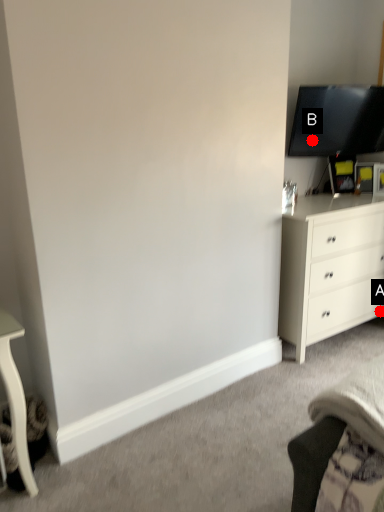
Question: Two points are circled on the image, labeled by A and B beside each circle. Which point is closer to the camera?

Choices:
 (A) A is closer
 (B) B is closer

Answer: (B)